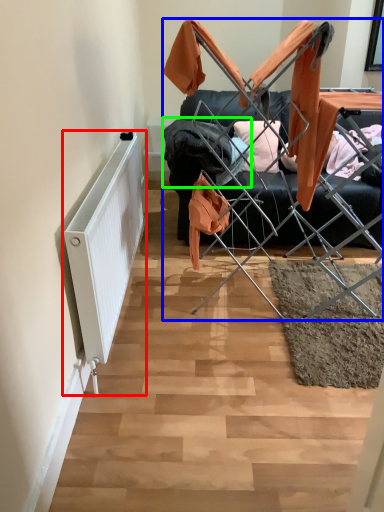
Question: Which object is positioned farthest from radiator (highlighted by a red box)? Select from furniture (highlighted by a blue box) and clothing (highlighted by a green box).

Choices:
 (A) furniture
 (B) clothing

Answer: (A)